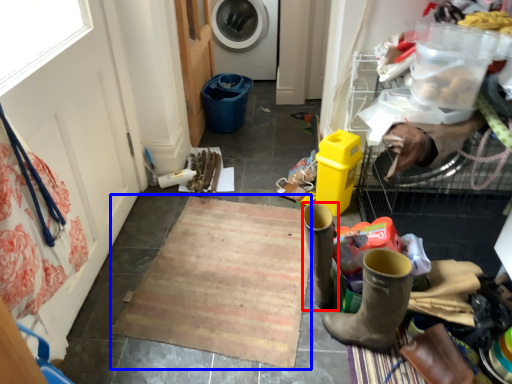
Question: Which object is closer to the camera taking this photo, footwear (highlighted by a red box) or doormat (highlighted by a blue box)?

Choices:
 (A) footwear
 (B) doormat

Answer: (A)